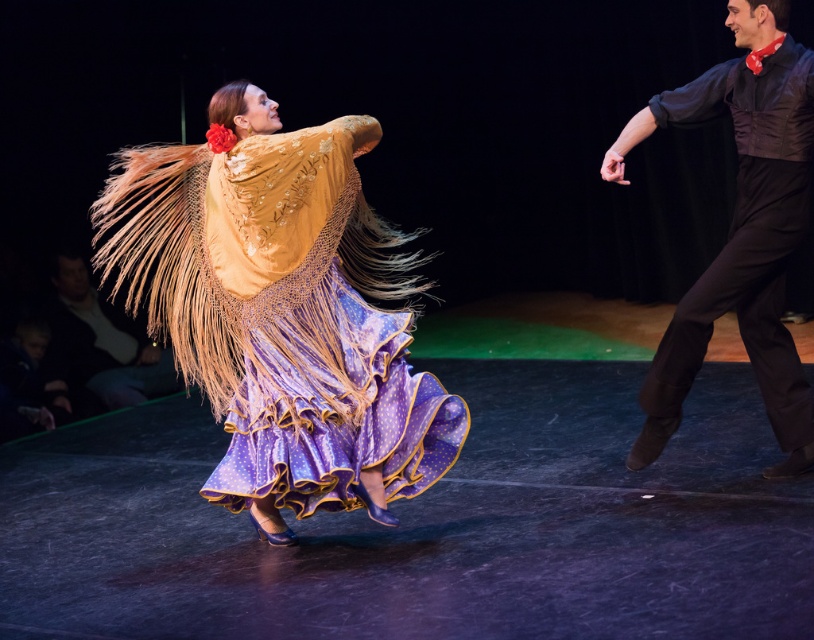
Can you confirm if velvet/yellow/golden shawl at left is wider than shiny black shirt at right?

Yes, velvet/yellow/golden shawl at left is wider than shiny black shirt at right.

Is velvet/yellow/golden shawl at left positioned at the back of shiny black shirt at right?

That is False.

I want to click on velvet/yellow/golden shawl at left, so tap(282, 312).

Does velvet/yellow/golden shawl at left have a lesser width compared to dark brown leather jacket at lower left?

No.

Image resolution: width=814 pixels, height=640 pixels. Find the location of `velvet/yellow/golden shawl at left`. velvet/yellow/golden shawl at left is located at coordinates (282, 312).

Who is taller, shiny black shirt at right or dark brown leather jacket at lower left?

shiny black shirt at right

Does point (742, 186) lie in front of point (134, 362)?

Yes, it is in front of point (134, 362).

What are the coordinates of `shiny black shirt at right` in the screenshot? It's located at (740, 230).